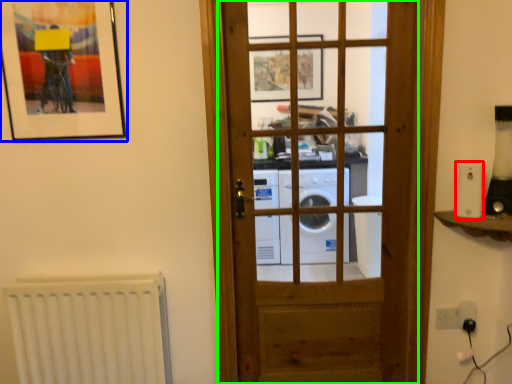
Question: Considering the real-world distances, which object is farthest from appliance (highlighted by a red box)? picture frame (highlighted by a blue box) or door (highlighted by a green box)?

Choices:
 (A) picture frame
 (B) door

Answer: (A)